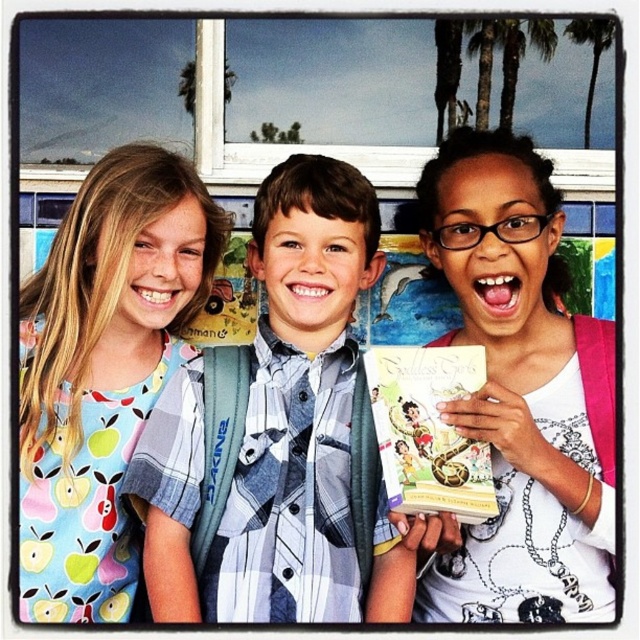
You are a photographer trying to capture a closeup shot of both the plaid shirt at center and the hardcover book at center. Can you fit both into your camera frame if your lens has a maximum field of view of 12 inches?

The distance between the plaid shirt at center and the hardcover book at center is 12.24 inches, which exceeds the lens field of view of 12 inches. Therefore, you cannot fit both into the frame.

You are a photographer trying to focus on two points in the image. The first point is at coordinate point (296, 608) and the second point is at coordinate point (371, 348). Which point is closer to you?

Point (296, 608) is closer to the viewer than point (371, 348).

You are a photographer trying to capture a closeup shot of the plaid shirt at center and the white glossy book at center. Given that your camera can only focus on objects within 40 centimeters of each other, will you be able to get a clear photo of both subjects at the same time?

The distance between the plaid shirt at center and the white glossy book at center is 44.91 centimeters. Since the camera requires objects to be within 40 centimeters of each other for clear focus, the 44.91 cm distance exceeds this limit. Therefore, you won t be able to capture both subjects in focus simultaneously.